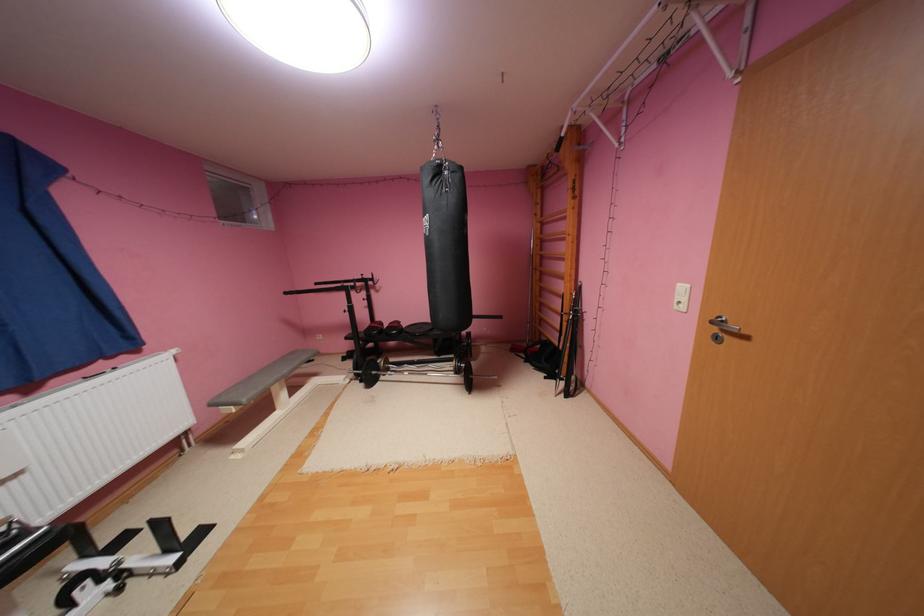
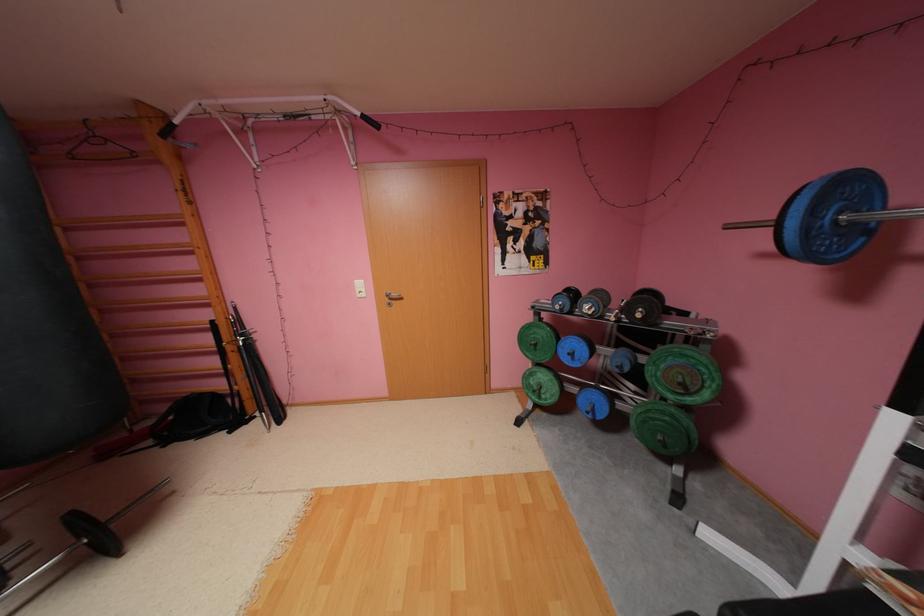
The point at (552, 224) is marked in the first image. Where is the corresponding point in the second image?

(76, 229)